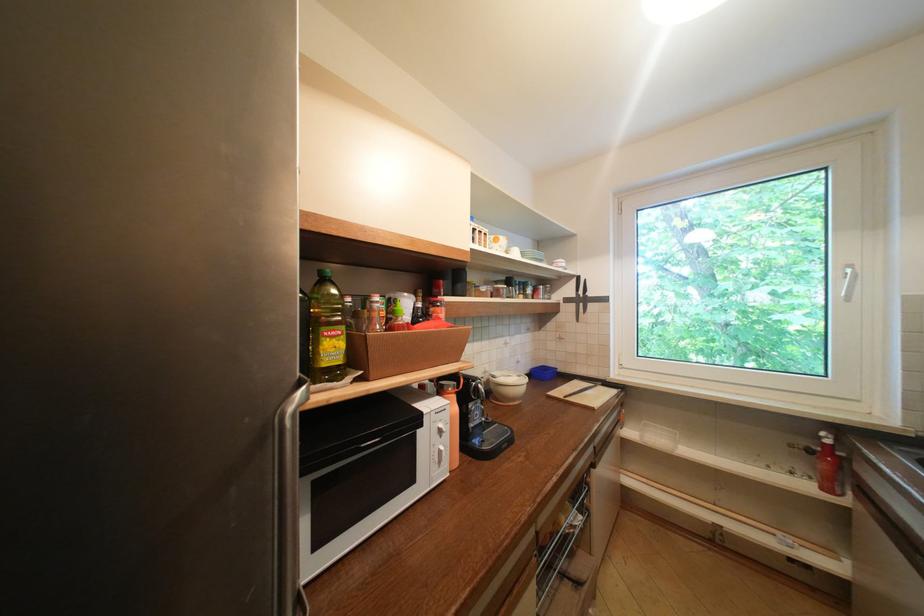
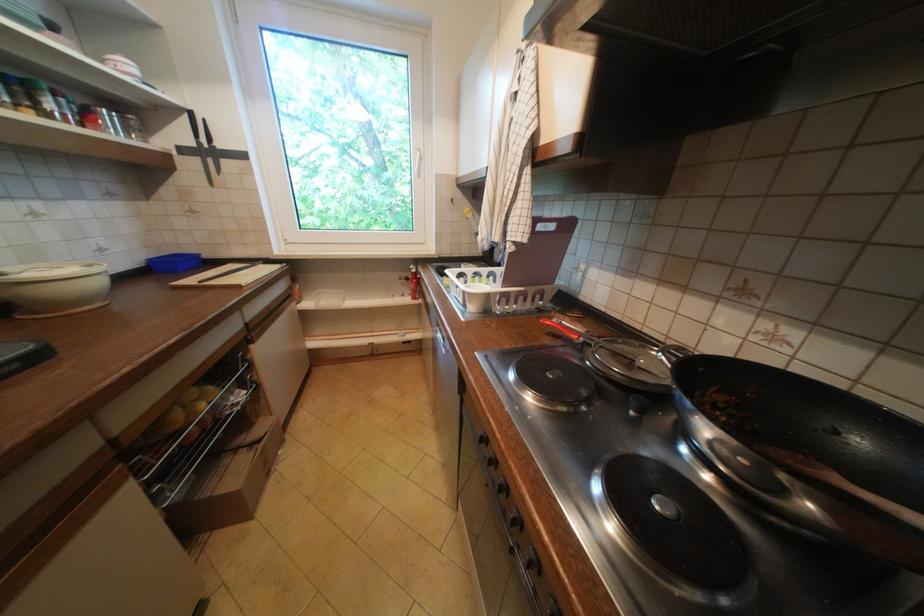
Locate, in the second image, the point that corresponds to (589,552) in the first image.

(270, 419)